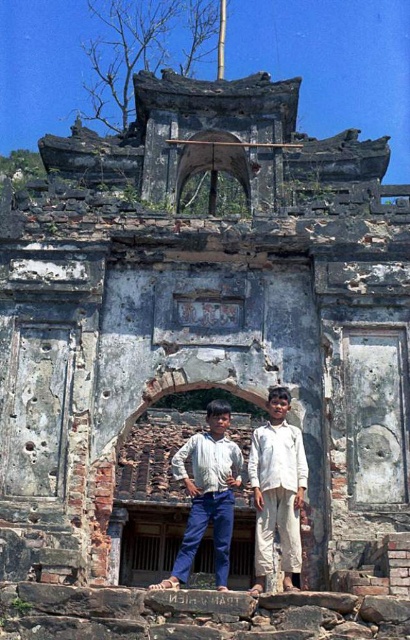
Based on the photo, how distant is white cotton pants at center from white cotton shirt at center?

33.28 inches

Is white cotton pants at center taller than white cotton shirt at center?

Incorrect, white cotton pants at center's height is not larger of white cotton shirt at center's.

The image size is (410, 640). In order to click on white cotton pants at center in this screenshot , I will do `click(277, 490)`.